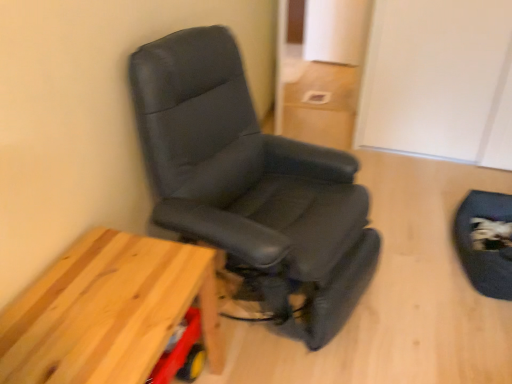
Question: Does black leather swivel chair at lower right have a lesser height compared to black leather chair at left?

Choices:
 (A) no
 (B) yes

Answer: (B)

Question: Is black leather swivel chair at lower right facing towards black leather chair at left?

Choices:
 (A) yes
 (B) no

Answer: (A)

Question: Considering the relative sizes of black leather swivel chair at lower right and black leather chair at left in the image provided, is black leather swivel chair at lower right taller than black leather chair at left?

Choices:
 (A) no
 (B) yes

Answer: (A)

Question: Considering the relative sizes of black leather swivel chair at lower right and black leather chair at left in the image provided, is black leather swivel chair at lower right bigger than black leather chair at left?

Choices:
 (A) no
 (B) yes

Answer: (A)

Question: From a real-world perspective, does black leather swivel chair at lower right stand above black leather chair at left?

Choices:
 (A) no
 (B) yes

Answer: (A)

Question: From the image's perspective, relative to black leather swivel chair at lower right, is black leather chair at left above or below?

Choices:
 (A) above
 (B) below

Answer: (A)

Question: Is black leather chair at left spatially inside black leather swivel chair at lower right, or outside of it?

Choices:
 (A) inside
 (B) outside

Answer: (B)

Question: Based on their positions, is black leather chair at left located to the left or right of black leather swivel chair at lower right?

Choices:
 (A) right
 (B) left

Answer: (B)

Question: Looking at the image, does black leather chair at left seem bigger or smaller compared to black leather swivel chair at lower right?

Choices:
 (A) big
 (B) small

Answer: (A)

Question: Does point (20, 355) appear closer or farther from the camera than point (505, 248)?

Choices:
 (A) farther
 (B) closer

Answer: (B)

Question: Is wooden table at lower left bigger or smaller than black leather swivel chair at lower right?

Choices:
 (A) small
 (B) big

Answer: (B)

Question: From a real-world perspective, relative to black leather swivel chair at lower right, is wooden table at lower left vertically above or below?

Choices:
 (A) above
 (B) below

Answer: (A)

Question: Is wooden table at lower left taller or shorter than black leather swivel chair at lower right?

Choices:
 (A) short
 (B) tall

Answer: (B)

Question: Considering the relative positions of wooden table at lower left and black leather chair at left in the image provided, is wooden table at lower left to the left or to the right of black leather chair at left?

Choices:
 (A) left
 (B) right

Answer: (A)

Question: From the image's perspective, is wooden table at lower left above or below black leather chair at left?

Choices:
 (A) above
 (B) below

Answer: (B)